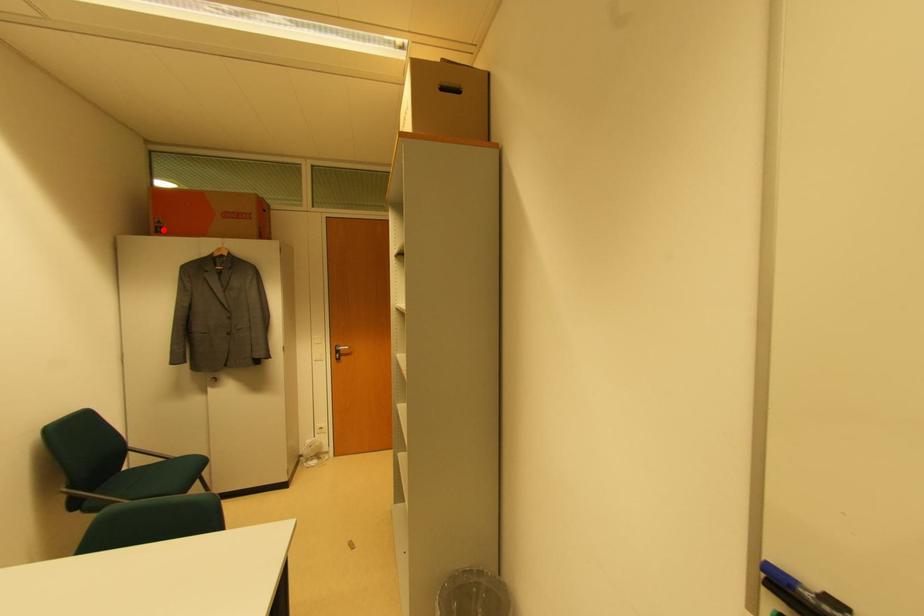
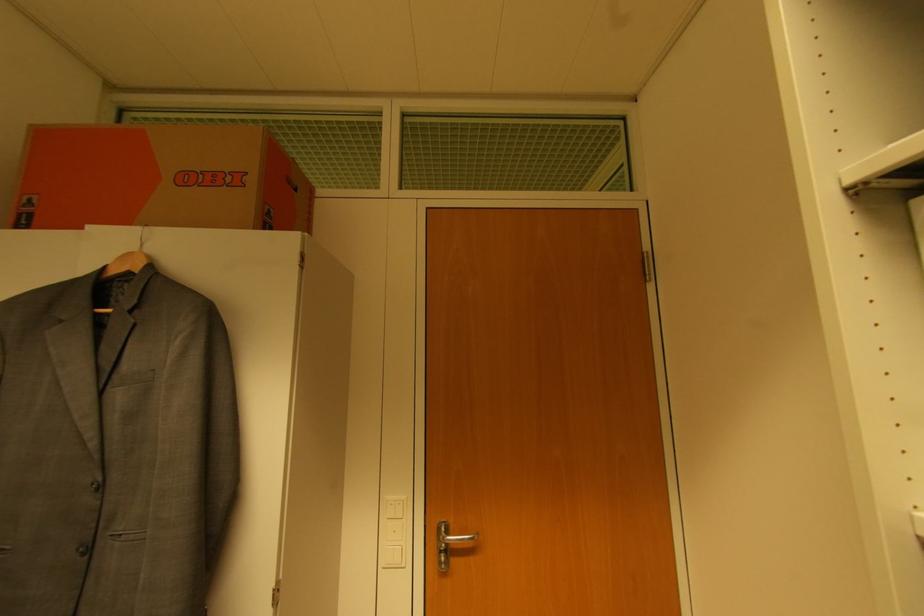
Where in the second image is the point corresponding to the highlighted location from the first image?

(32, 217)